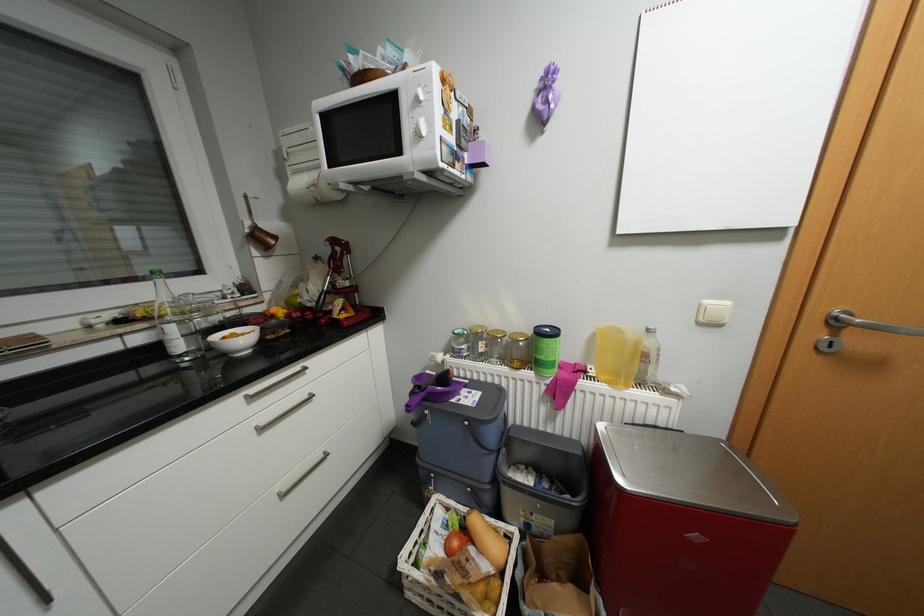
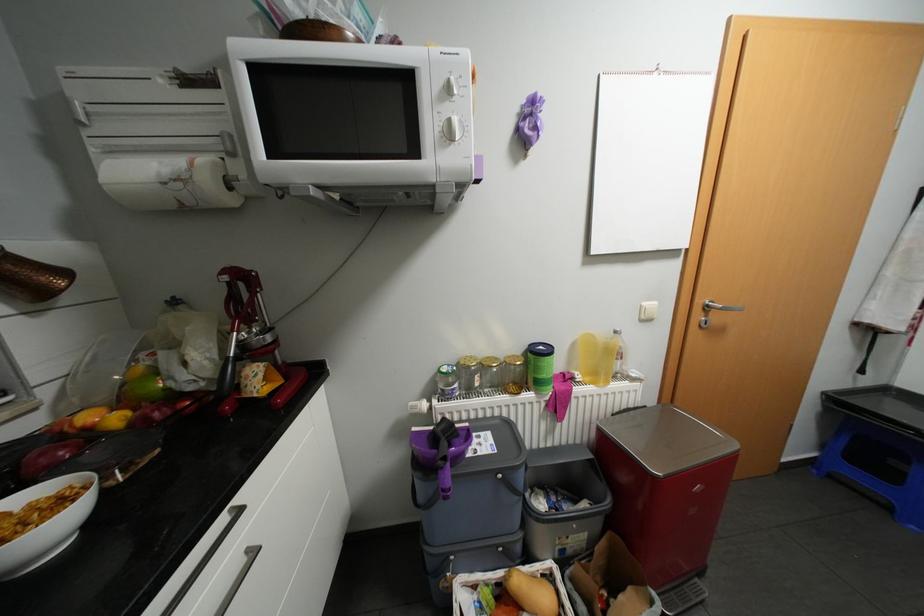
Locate, in the second image, the point that corresponds to (x=544, y=373) in the first image.

(544, 392)